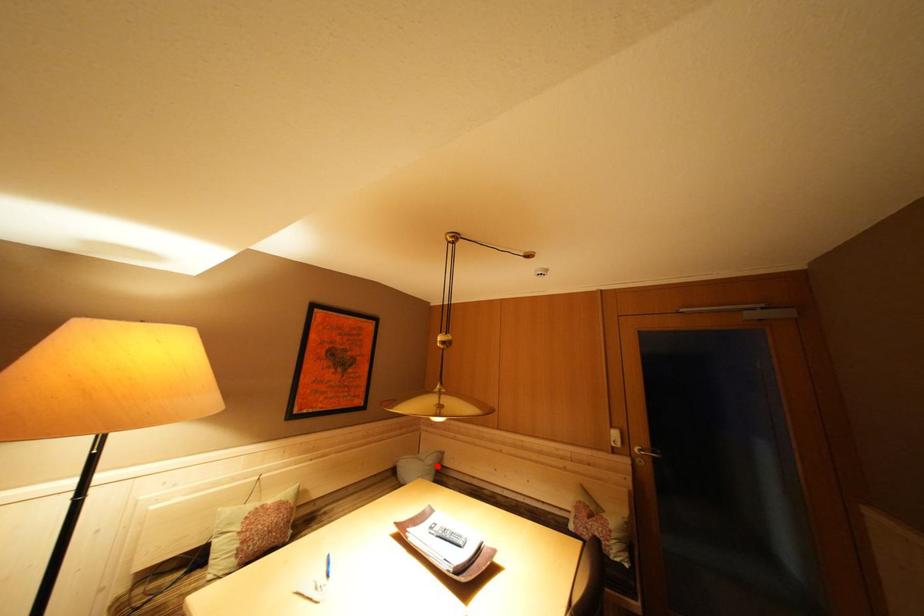
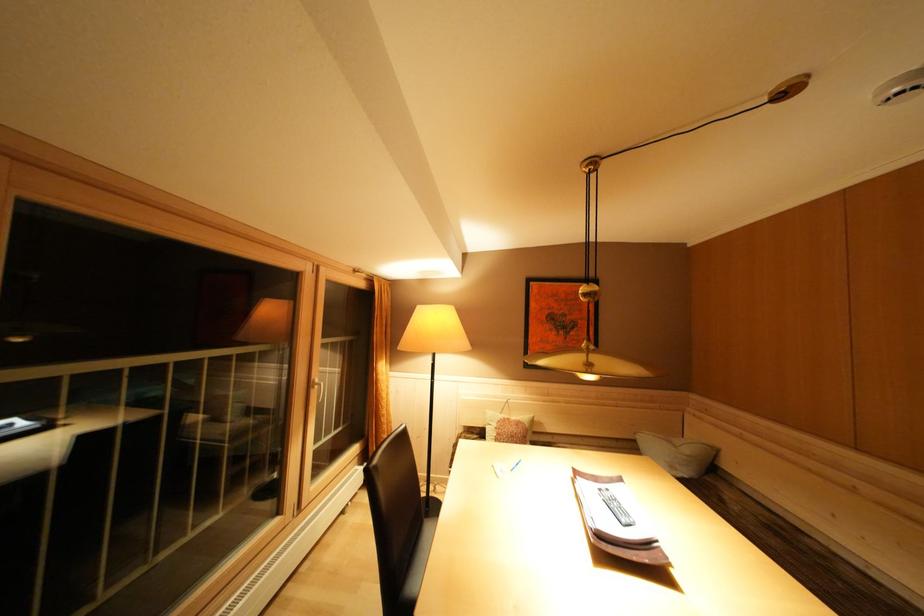
Question: I am providing you with two images of the same scene from different viewpoints. Image1 has a red point marked. In image2, the corresponding 3D location appears at what relative position? Reply with the corresponding letter.

Choices:
 (A) Closer
 (B) Farther

Answer: (A)